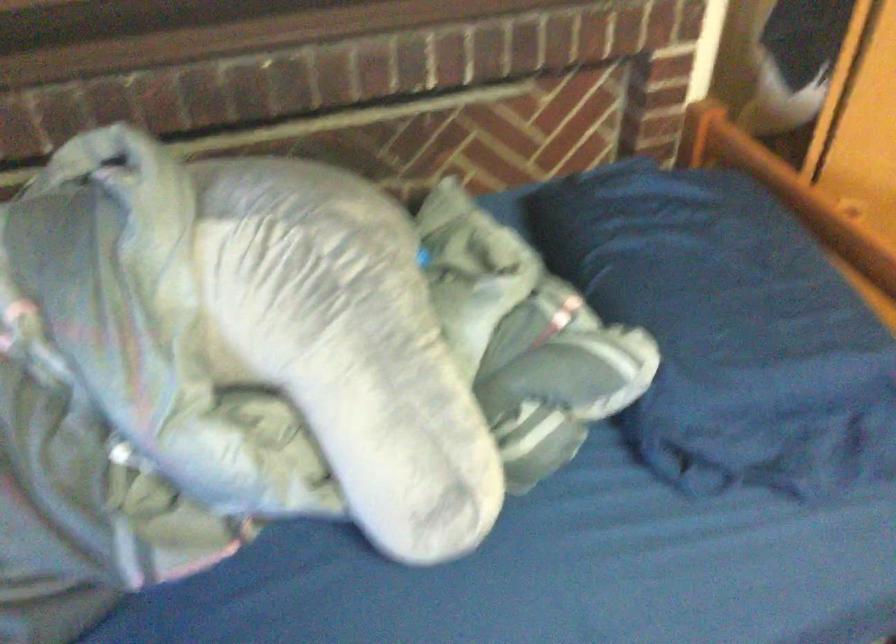
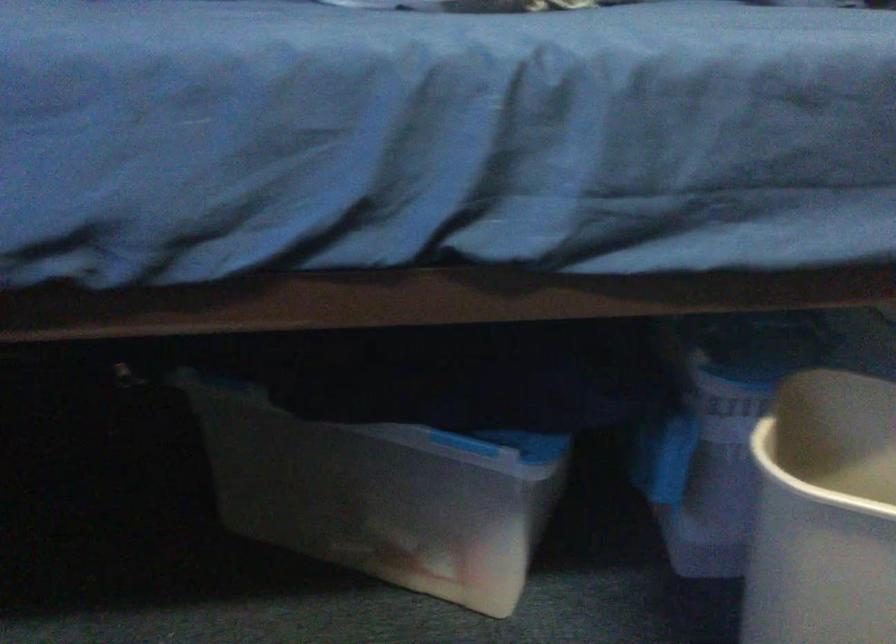
Question: How did the camera likely rotate?

Choices:
 (A) Left
 (B) Right
 (C) Up
 (D) Down

Answer: (C)